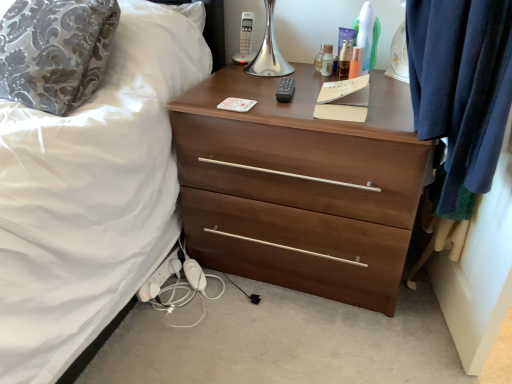
Identify the location of free space that is to the left of black plastic remote at center. The height and width of the screenshot is (384, 512). [x=231, y=93].